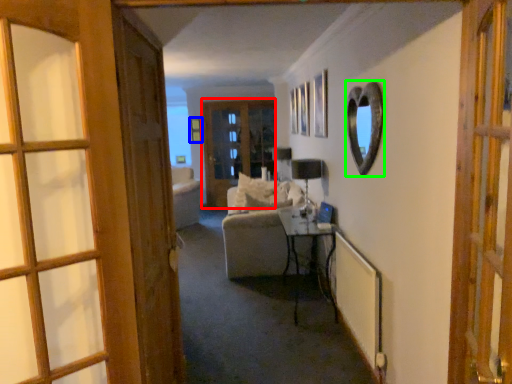
Question: Which is farther away from door (highlighted by a red box)? picture frame (highlighted by a blue box) or mirror (highlighted by a green box)?

Choices:
 (A) picture frame
 (B) mirror

Answer: (B)